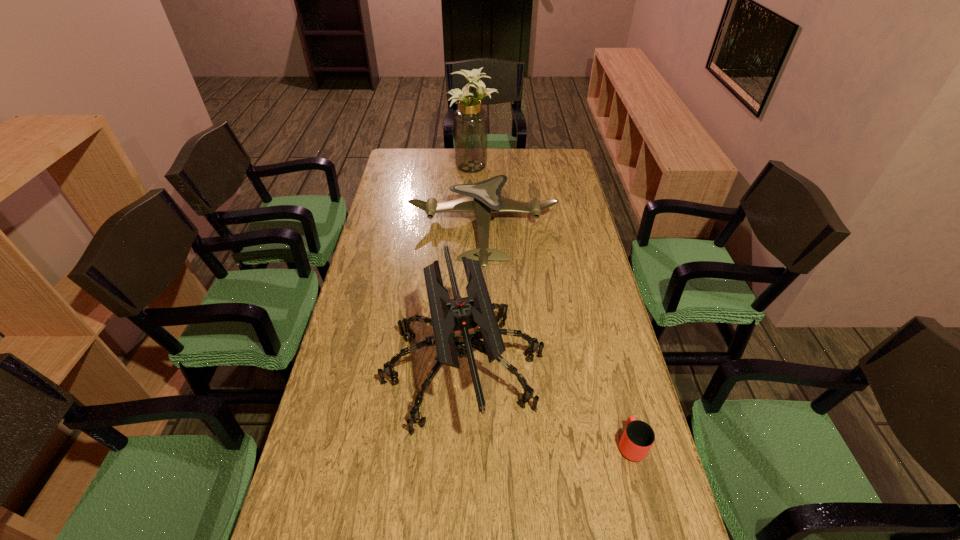
The image size is (960, 540). Identify the location of flower arrangement. (470, 121).

The height and width of the screenshot is (540, 960). I want to click on the farthest object, so click(470, 121).

This screenshot has width=960, height=540. I want to click on the third shortest object, so click(456, 322).

The height and width of the screenshot is (540, 960). In order to click on the nearer drone in this screenshot , I will do `click(456, 322)`.

Where is `the farther drone`? The height and width of the screenshot is (540, 960). the farther drone is located at coordinates (483, 198).

Locate an element on the screen. the shorter drone is located at coordinates (483, 198).

This screenshot has height=540, width=960. Find the location of `the shortest object`. the shortest object is located at coordinates (638, 437).

Where is `cup`? cup is located at coordinates (638, 437).

Image resolution: width=960 pixels, height=540 pixels. What are the coordinates of `vacant space situated on the front of the tallest object` in the screenshot? It's located at (473, 181).

Locate an element on the screen. vacant space located on the right of the nearer drone is located at coordinates pyautogui.click(x=584, y=369).